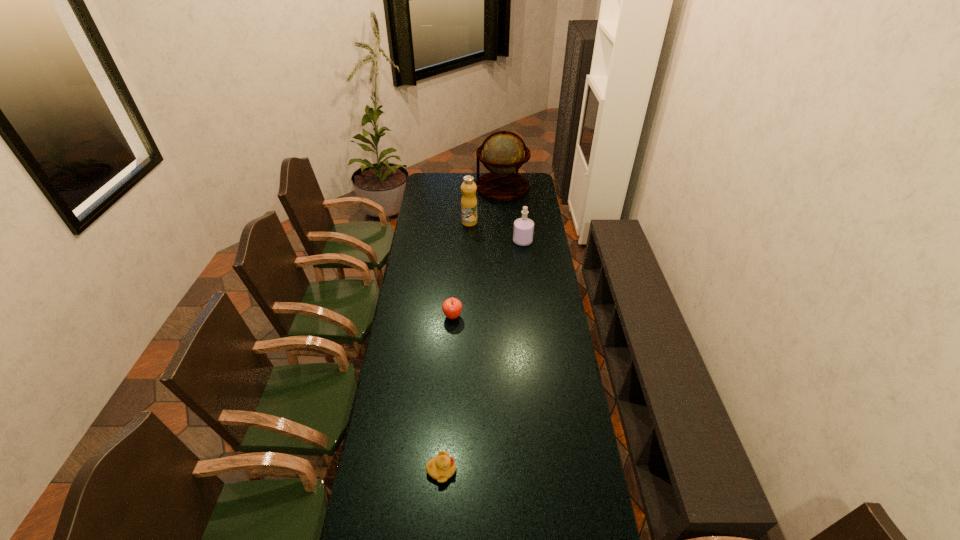
Identify the location of object at the far right corner. This screenshot has height=540, width=960. (503, 153).

Find the location of a particular element. The height and width of the screenshot is (540, 960). vacant area at the far edge of the desktop is located at coordinates (474, 175).

The image size is (960, 540). Identify the location of vacant space at the left edge. (420, 296).

Locate an element on the screen. The image size is (960, 540). free space at the right edge is located at coordinates (548, 327).

Locate an element on the screen. Image resolution: width=960 pixels, height=540 pixels. vacant space in between the shortest object and the farthest object is located at coordinates (471, 328).

This screenshot has width=960, height=540. Find the location of `free spot between the perfume and the duckling`. free spot between the perfume and the duckling is located at coordinates (482, 356).

Where is `free space that is in between the globe and the fourth farthest object`? free space that is in between the globe and the fourth farthest object is located at coordinates (477, 252).

Identify the location of unoccupied position between the globe and the nearest object. (471, 328).

Where is `vacant space in between the perfume and the farthest object`? The image size is (960, 540). vacant space in between the perfume and the farthest object is located at coordinates (513, 214).

Locate an element on the screen. The height and width of the screenshot is (540, 960). object that can be found as the third closest to the farthest object is located at coordinates (452, 307).